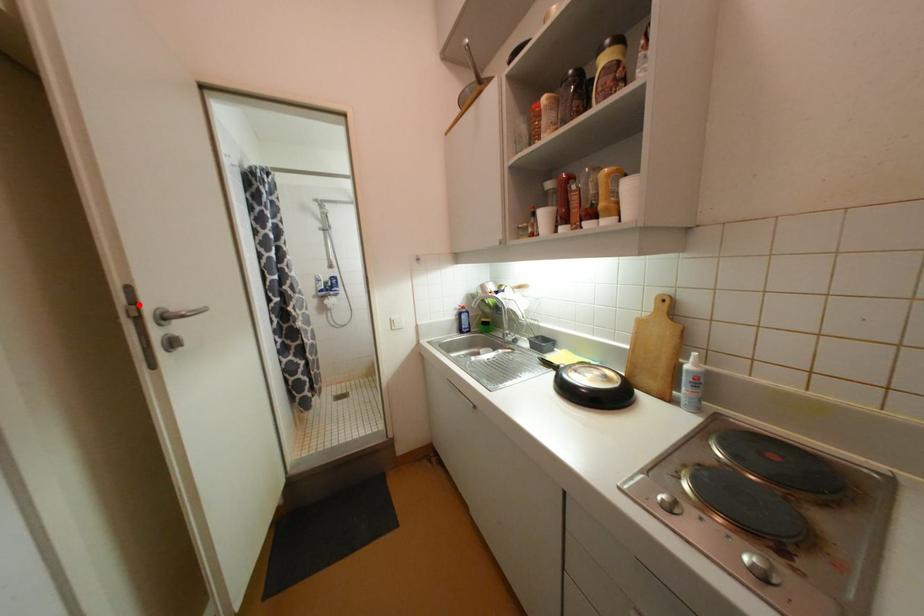
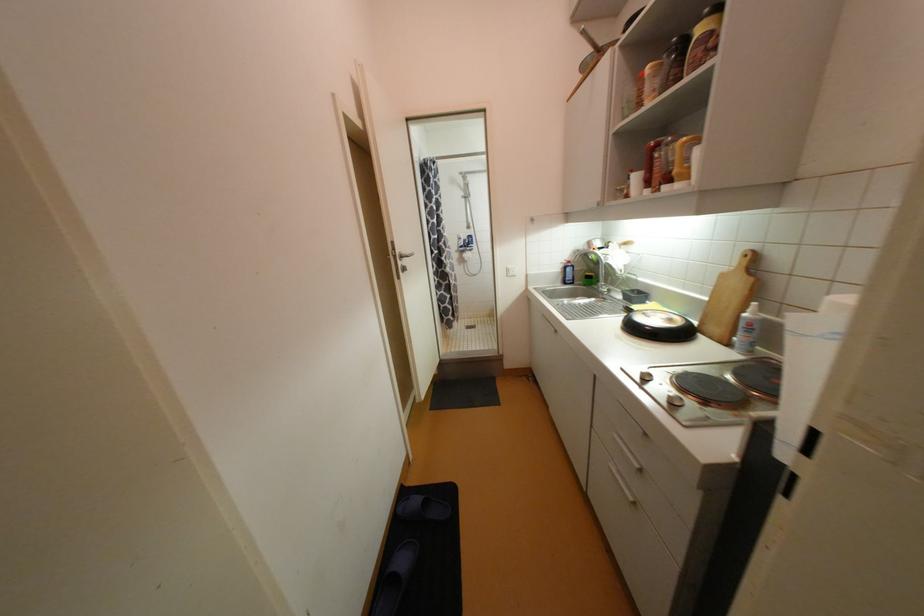
Question: I am providing you with two images of the same scene from different viewpoints. In image1, a red point is highlighted. Considering the same 3D point in image2, which of the following is correct?

Choices:
 (A) It is closer
 (B) It is farther

Answer: (A)